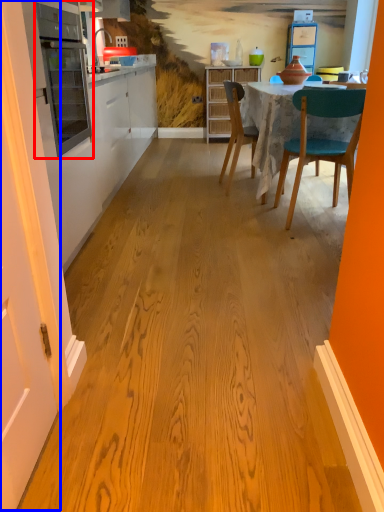
Question: Among these objects, which one is nearest to the camera, appliance (highlighted by a red box) or door (highlighted by a blue box)?

Choices:
 (A) appliance
 (B) door

Answer: (B)